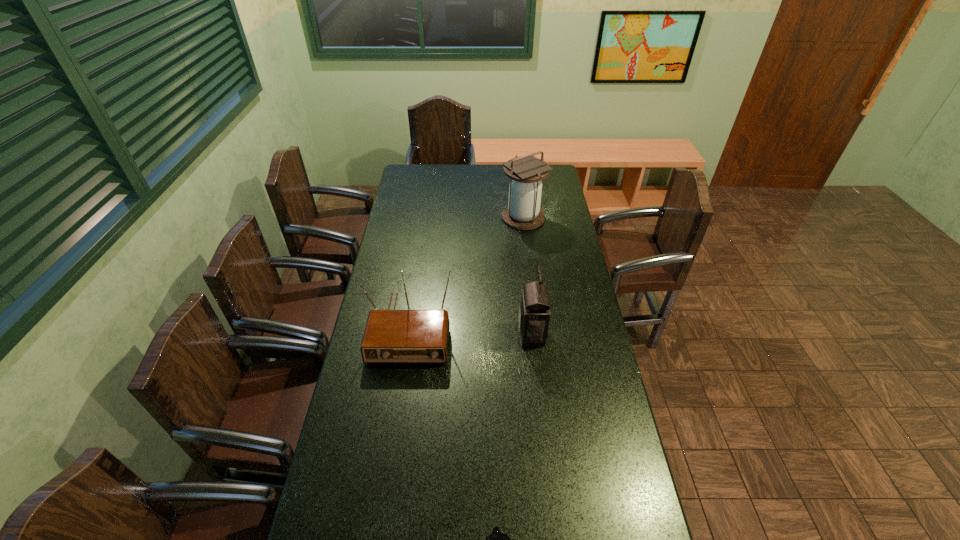
This screenshot has height=540, width=960. Find the location of `the farthest object`. the farthest object is located at coordinates (526, 173).

This screenshot has height=540, width=960. In order to click on the second farthest lantern in this screenshot , I will do `click(534, 311)`.

At what (x,y) coordinates should I click in order to perform the action: click on the leftmost object. Please return your answer as a coordinate pair (x, y). Looking at the image, I should click on (391, 336).

Locate an element on the screen. free region located on the left of the farthest object is located at coordinates (420, 218).

At what (x,y) coordinates should I click in order to perform the action: click on vacant space located 0.080m on the front-facing side of the second farthest lantern. Please return your answer as a coordinate pair (x, y). The height and width of the screenshot is (540, 960). Looking at the image, I should click on (495, 334).

Find the location of `free space located on the front-facing side of the second farthest lantern`. free space located on the front-facing side of the second farthest lantern is located at coordinates (490, 334).

Where is `vacant space located on the front-facing side of the second farthest lantern`? This screenshot has height=540, width=960. vacant space located on the front-facing side of the second farthest lantern is located at coordinates (498, 334).

You are a GUI agent. You are given a task and a screenshot of the screen. Output one action in this format:
    pyautogui.click(x=<x>, y=<y>)
    Task: Click on the vacant space located on the front panel of the radio_receiver
    
    Given the screenshot: What is the action you would take?
    pyautogui.click(x=393, y=434)

Find the location of a particular element. object at the left edge is located at coordinates (391, 336).

Locate an element on the screen. object located at the right edge is located at coordinates (526, 173).